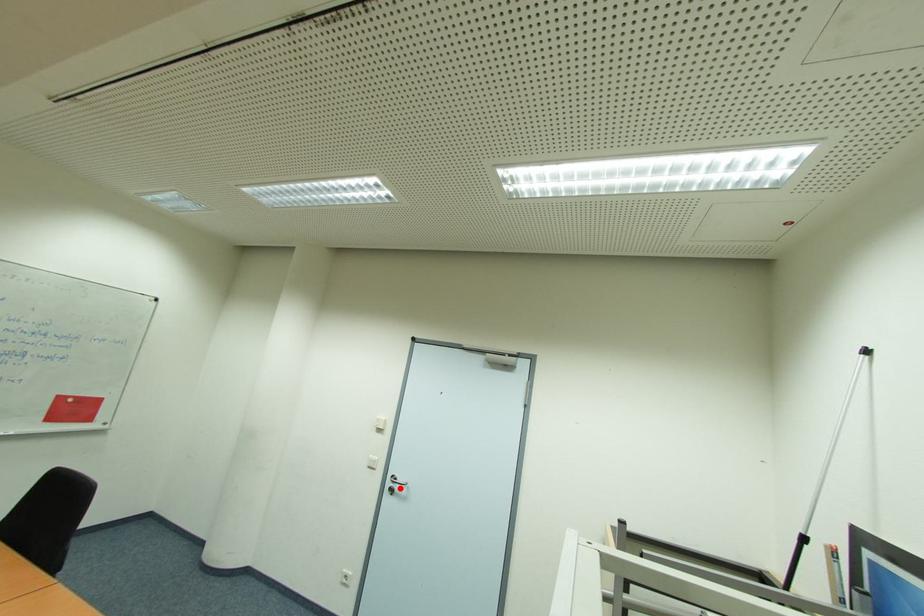
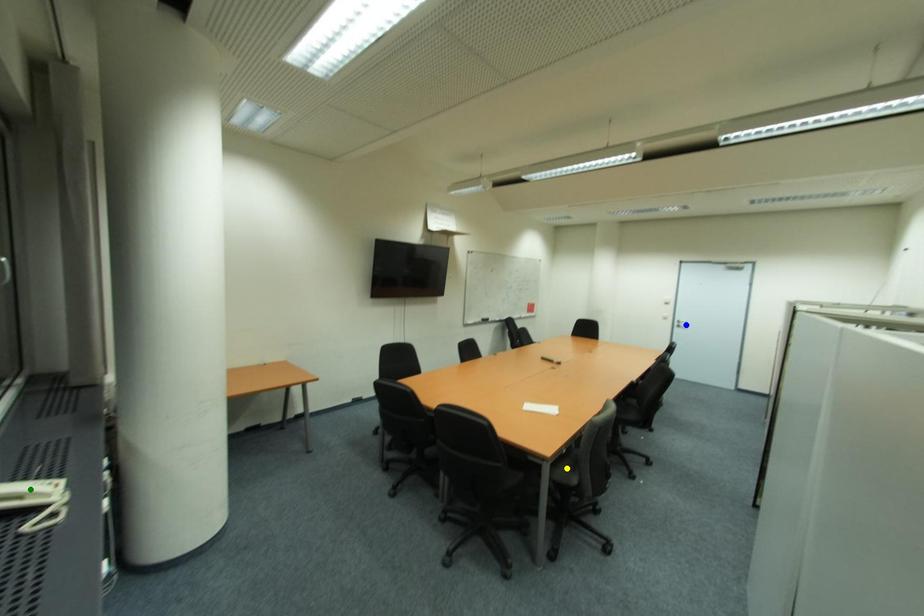
Question: I am providing you with two images of the same scene from different viewpoints. A red point is marked on the first image. You are given multiple points on the second image. Which mark in image 2 goes with the point in image 1?

Choices:
 (A) yellow point
 (B) green point
 (C) blue point

Answer: (C)